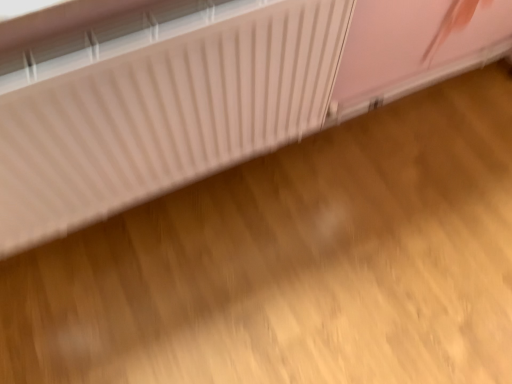
The width and height of the screenshot is (512, 384). Identify the location of white matte radiator at upper left. (157, 105).

Describe the element at coordinates (157, 105) in the screenshot. This screenshot has height=384, width=512. I see `white matte radiator at upper left` at that location.

I want to click on white matte radiator at upper left, so click(157, 105).